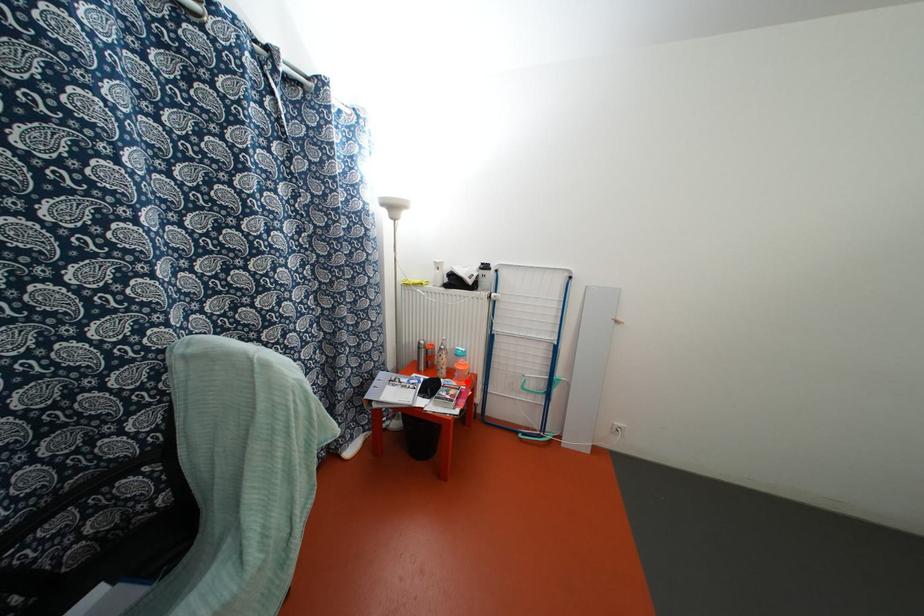
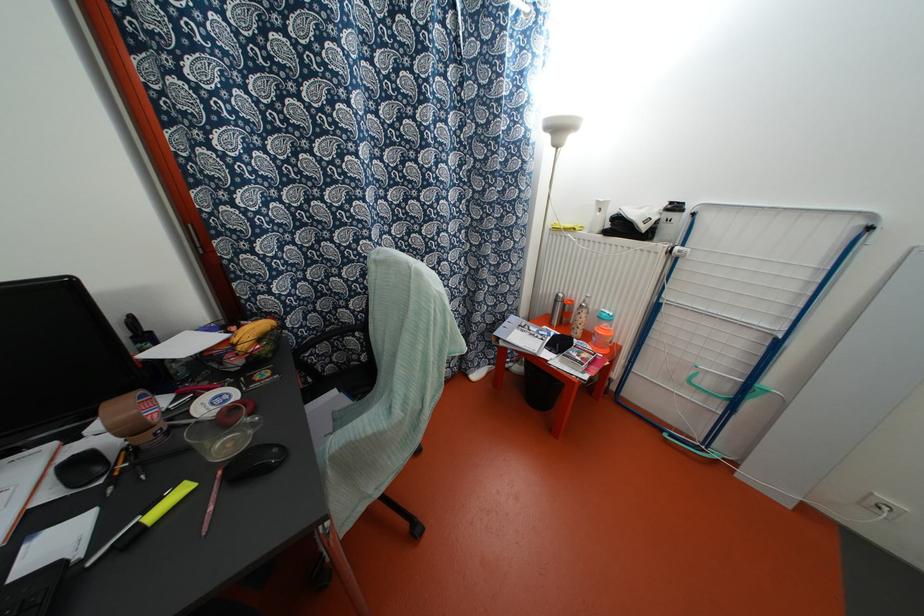
Question: I am providing you with two images of the same scene from different viewpoints. In image1, a red point is highlighted. Considering the same 3D point in image2, which of the following is correct?

Choices:
 (A) It is closer
 (B) It is farther

Answer: (A)